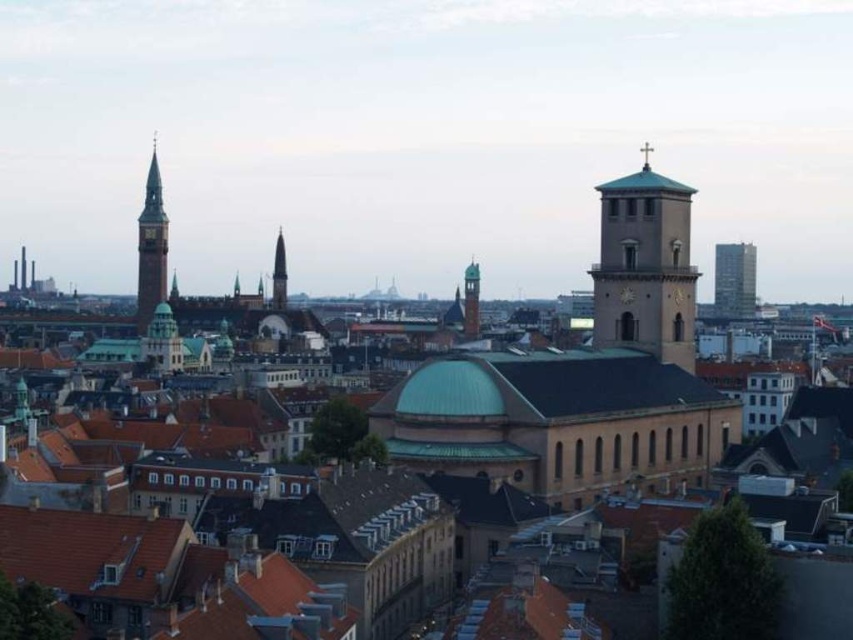
Question: Estimate the real-world distances between objects in this image. Which object is farther from the green glass skyscraper at upper right?

Choices:
 (A) light brown stone bell tower at center right
 (B) smooth brown clock tower at left

Answer: (A)

Question: Does light brown stone bell tower at center right appear over smooth gold spire at center?

Choices:
 (A) yes
 (B) no

Answer: (A)

Question: Does light brown stone bell tower at center right have a lesser width compared to smooth brown clock tower at left?

Choices:
 (A) no
 (B) yes

Answer: (B)

Question: Which point is farther to the camera?

Choices:
 (A) smooth gold spire at center
 (B) light brown stone bell tower at center right

Answer: (A)

Question: From the image, what is the correct spatial relationship of light brown stone bell tower at center right in relation to smooth gold spire at center?

Choices:
 (A) right
 (B) left

Answer: (A)

Question: Which object is farther from the camera taking this photo?

Choices:
 (A) green glass skyscraper at upper right
 (B) light brown stone bell tower at center right

Answer: (A)